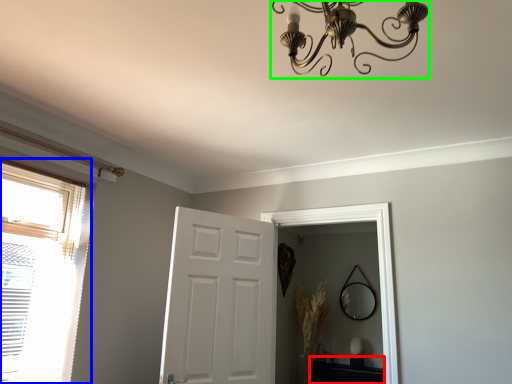
Question: Which object is the closest to the table (highlighted by a red box)? Choose among these: window (highlighted by a blue box) or light fixture (highlighted by a green box).

Choices:
 (A) window
 (B) light fixture

Answer: (A)